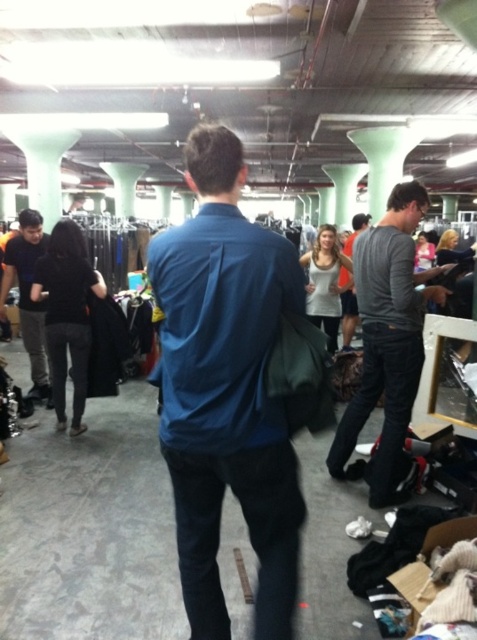
Is point (175, 353) less distant than point (435, 301)?

Yes, it is.

Can you confirm if blue smooth shirt at center is thinner than gray cotton shirt at right?

Yes, blue smooth shirt at center is thinner than gray cotton shirt at right.

Does point (218, 204) come closer to viewer compared to point (404, 364)?

Yes, it is in front of point (404, 364).

Identify the location of blue smooth shirt at center. The image size is (477, 640). (227, 388).

Who is shorter, gray cotton shirt at right or matte gray sweater at center?

Standing shorter between the two is matte gray sweater at center.

Is gray cotton shirt at right shorter than matte gray sweater at center?

In fact, gray cotton shirt at right may be taller than matte gray sweater at center.

Describe the element at coordinates (387, 339) in the screenshot. I see `gray cotton shirt at right` at that location.

I want to click on gray cotton shirt at right, so click(387, 339).

Based on the photo, can you confirm if gray cotton shirt at right is bigger than matte black jacket at left?

No.

Is gray cotton shirt at right shorter than matte black jacket at left?

No, gray cotton shirt at right is not shorter than matte black jacket at left.

Image resolution: width=477 pixels, height=640 pixels. Describe the element at coordinates (387, 339) in the screenshot. I see `gray cotton shirt at right` at that location.

Locate an element on the screen. gray cotton shirt at right is located at coordinates (387, 339).